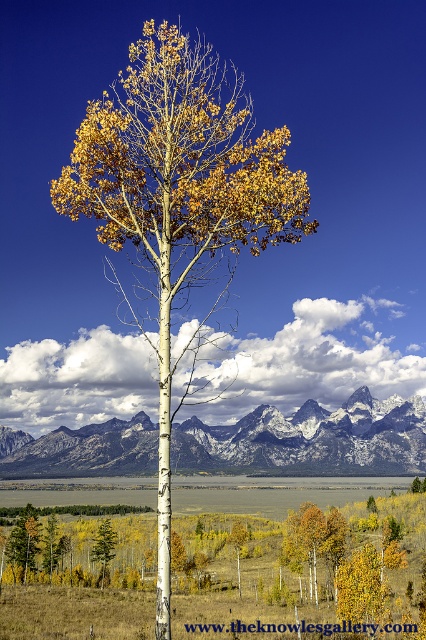
Question: Is matte white birch tree at center positioned before yellow matte tree at center?

Choices:
 (A) no
 (B) yes

Answer: (B)

Question: Does snowy granite mountains at center come behind golden yellow leaves at center?

Choices:
 (A) yes
 (B) no

Answer: (A)

Question: Which is nearer to the matte white birch tree at center?

Choices:
 (A) golden yellow leaves at center
 (B) yellow matte tree at center
 (C) golden aspen tree at center
 (D) snowy granite mountains at center

Answer: (D)

Question: Among these points, which one is nearest to the camera?

Choices:
 (A) (17, 545)
 (B) (100, 536)
 (C) (368, 406)

Answer: (A)

Question: Is matte white birch tree at center smaller than yellow matte tree at center?

Choices:
 (A) no
 (B) yes

Answer: (A)

Question: Estimate the real-world distances between objects in this image. Which object is farther from the golden aspen tree at center?

Choices:
 (A) matte white birch tree at center
 (B) golden yellow leaves at center

Answer: (A)